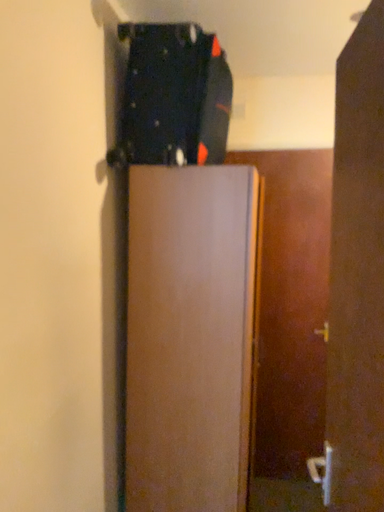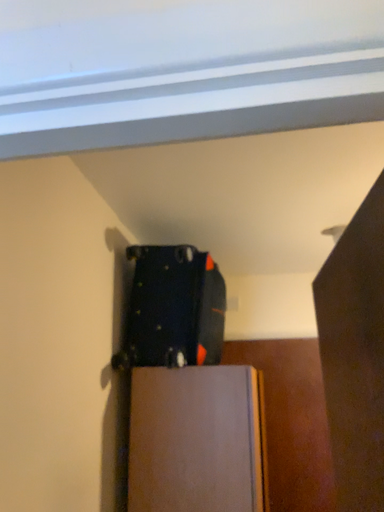
Question: Which way did the camera rotate in the video?

Choices:
 (A) rotated upward
 (B) rotated downward

Answer: (A)